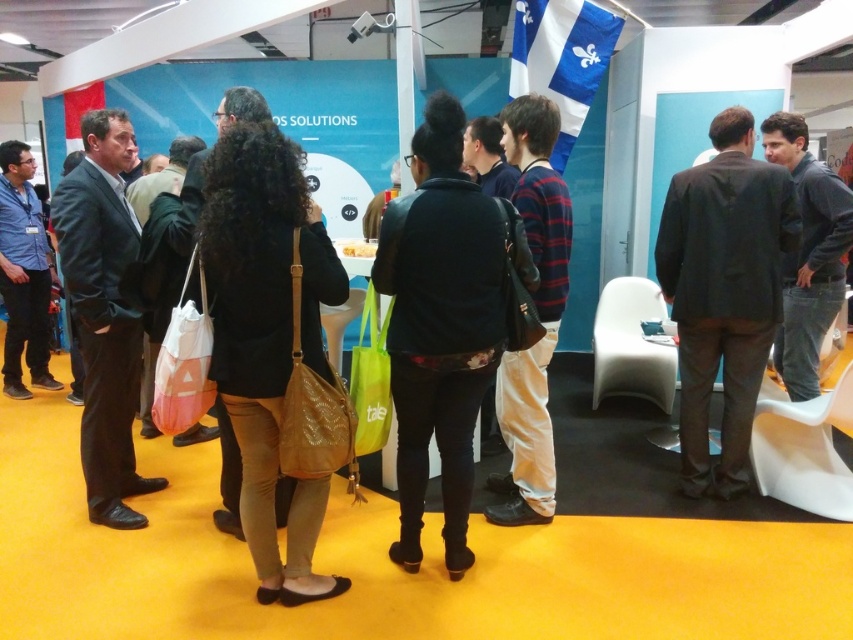
Question: Is dark blue jacket at center to the right of dark brown suit at center from the viewer's perspective?

Choices:
 (A) no
 (B) yes

Answer: (A)

Question: Does dark blue jacket at center have a greater width compared to dark brown suit at center?

Choices:
 (A) yes
 (B) no

Answer: (A)

Question: Does dark blue jacket at center have a lesser width compared to dark brown suit at center?

Choices:
 (A) yes
 (B) no

Answer: (B)

Question: Among these points, which one is nearest to the camera?

Choices:
 (A) click(416, 294)
 (B) click(741, 484)

Answer: (A)

Question: Which object appears closest to the camera in this image?

Choices:
 (A) dark brown suit at center
 (B) dark blue jacket at center

Answer: (B)

Question: Which point is farther from the camera taking this photo?

Choices:
 (A) (729, 154)
 (B) (381, 250)

Answer: (A)